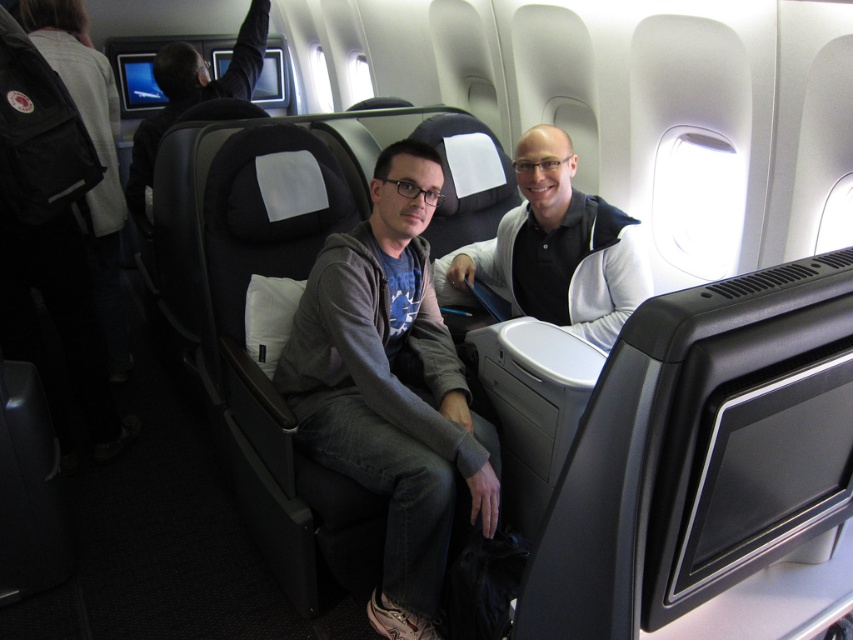
You are a flight attendant checking the seating arrangement. You need to locate the gray hoodie at center and the black leather seat at upper left. Based on their positions, which object is closer to the camera?

The gray hoodie at center is closer to the camera because it is located below the black leather seat at upper left, meaning the hoodie is positioned in front of the seat in the visual plane.

Consider the image. You are seated in the airplane cabin and need to retrieve your jacket from the overhead compartment. You see the gray hoodie at center and the black leather seat at upper left. Which object is positioned further to the right in the scene?

The gray hoodie at center is positioned further to the right compared to the black leather seat at upper left.